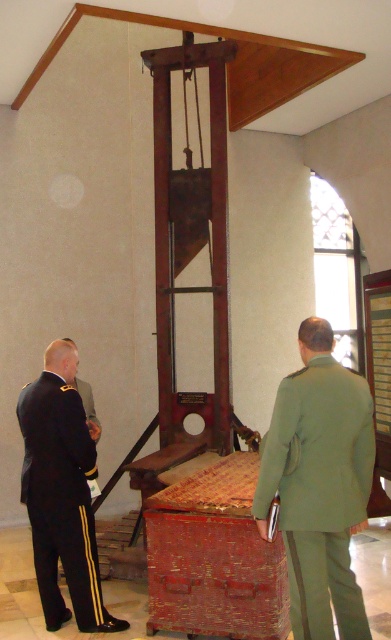
Measure the distance between point (x=322, y=369) and camera.

Point (x=322, y=369) is 2.95 meters away from camera.

Is green uniform at center to the left of black uniform at left from the viewer's perspective?

In fact, green uniform at center is to the right of black uniform at left.

Between point (338, 620) and point (64, 433), which one is positioned behind?

The point (64, 433) is more distant.

Image resolution: width=391 pixels, height=640 pixels. I want to click on green uniform at center, so click(319, 484).